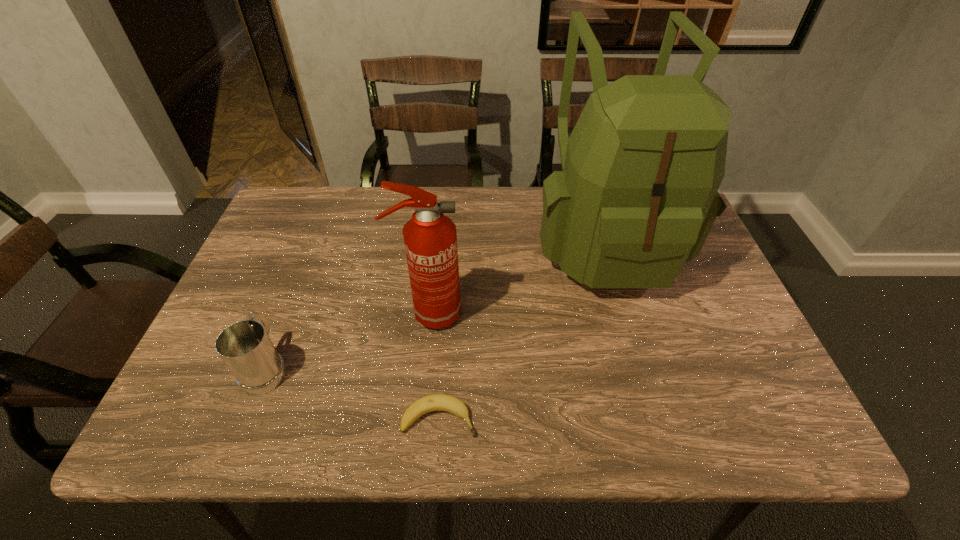
Find the location of a particular element. The width and height of the screenshot is (960, 540). free space between the leftmost object and the shortest object is located at coordinates [353, 393].

The image size is (960, 540). I want to click on free point between the banana and the backpack, so click(522, 329).

In order to click on vacant space that is in between the banana and the tallest object in this screenshot , I will do `click(522, 329)`.

Identify the location of object that is the third closest to the backpack. The width and height of the screenshot is (960, 540). 245,347.

You are a GUI agent. You are given a task and a screenshot of the screen. Output one action in this format:
    pyautogui.click(x=<x>, y=<y>)
    Task: Click on the closest object to the third shortest object
    
    Given the screenshot: What is the action you would take?
    pyautogui.click(x=436, y=402)

Where is `free space that satisfies the following two spatial constraints: 1. on the front pocket of the backpack; 2. at the nozzle of the fire extinguisher`? The image size is (960, 540). free space that satisfies the following two spatial constraints: 1. on the front pocket of the backpack; 2. at the nozzle of the fire extinguisher is located at coordinates (627, 314).

The width and height of the screenshot is (960, 540). In order to click on free space that satisfies the following two spatial constraints: 1. on the front pocket of the rightmost object; 2. at the nozzle of the third shortest object in this screenshot , I will do `click(627, 314)`.

Identify the location of vacant position in the image that satisfies the following two spatial constraints: 1. on the front pocket of the tallest object; 2. at the stem of the shortest object. (659, 418).

This screenshot has width=960, height=540. Find the location of `vacant region that satisfies the following two spatial constraints: 1. on the front pocket of the backpack; 2. at the stem of the shortest object`. vacant region that satisfies the following two spatial constraints: 1. on the front pocket of the backpack; 2. at the stem of the shortest object is located at coordinates (659, 418).

Locate an element on the screen. The height and width of the screenshot is (540, 960). vacant area in the image that satisfies the following two spatial constraints: 1. on the front pocket of the backpack; 2. at the stem of the shortest object is located at coordinates (659, 418).